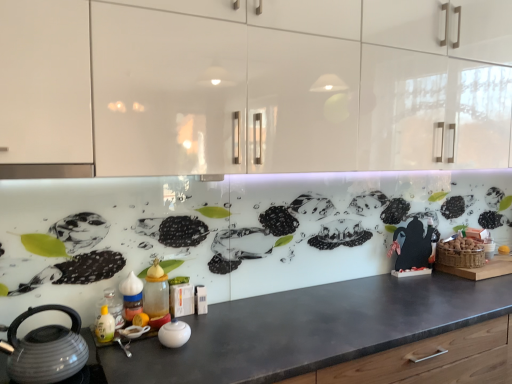
Locate an element on the screen. This screenshot has height=384, width=512. translucent plastic spice jar at center, the 2th bottle when ordered from right to left is located at coordinates (131, 296).

What do you see at coordinates (156, 296) in the screenshot? Image resolution: width=512 pixels, height=384 pixels. I see `translucent glass bottle at center, which appears as the third bottle when viewed from the left` at bounding box center [156, 296].

What do you see at coordinates (253, 86) in the screenshot? I see `white glossy cabinets at upper center` at bounding box center [253, 86].

The width and height of the screenshot is (512, 384). Describe the element at coordinates (111, 307) in the screenshot. I see `translucent plastic bottle at lower left, which is counted as the first bottle, starting from the left` at that location.

The height and width of the screenshot is (384, 512). Find the location of `matte gray kettle at lower left`. matte gray kettle at lower left is located at coordinates (46, 349).

Does white glossy bowl at center have a larger size compared to translucent plastic spice jar at center, the 2th bottle when ordered from right to left?

Incorrect, white glossy bowl at center is not larger than translucent plastic spice jar at center, the 2th bottle when ordered from right to left.

Could you tell me if white glossy bowl at center is facing translucent plastic spice jar at center, the 2th bottle when ordered from right to left?

No, white glossy bowl at center does not turn towards translucent plastic spice jar at center, the 2th bottle when ordered from right to left.

Based on their positions, is white glossy bowl at center located to the left or right of translucent plastic spice jar at center, the 2th bottle when ordered from right to left?

In the image, white glossy bowl at center appears on the right side of translucent plastic spice jar at center, the 2th bottle when ordered from right to left.

Is white glossy bowl at center further to camera compared to translucent plastic spice jar at center, the 2th bottle when ordered from right to left?

No.

Which of these two, white glossy cabinets at upper center or white glossy bowl at center, stands taller?

white glossy cabinets at upper center is taller.

From the image's perspective, is white glossy cabinets at upper center located above white glossy bowl at center?

Correct, white glossy cabinets at upper center appears higher than white glossy bowl at center in the image.

Where is `cabinetry that is above the white glossy bowl at center (from a real-world perspective)`? The image size is (512, 384). cabinetry that is above the white glossy bowl at center (from a real-world perspective) is located at coordinates (253, 86).

Is white glossy cabinets at upper center wider than white glossy bowl at center?

Correct, the width of white glossy cabinets at upper center exceeds that of white glossy bowl at center.

Based on their positions, is matte black countertop at center located to the left or right of matte gray kettle at lower left?

Clearly, matte black countertop at center is on the right of matte gray kettle at lower left in the image.

Identify the location of kettle to the left of matte black countertop at center. (46, 349).

From the image's perspective, is matte black countertop at center positioned above or below matte gray kettle at lower left?

From the image's perspective, matte black countertop at center appears below matte gray kettle at lower left.

How different are the orientations of matte black countertop at center and matte gray kettle at lower left in degrees?

There is a 1.27-degree angle between the facing directions of matte black countertop at center and matte gray kettle at lower left.

From the image's perspective, is translucent plastic spice jar at center, the 2th bottle when ordered from right to left, located beneath white glossy cabinets at upper center?

Yes, from the image's perspective, translucent plastic spice jar at center, the 2th bottle when ordered from right to left, is beneath white glossy cabinets at upper center.

Who is smaller, translucent plastic spice jar at center, the 2th bottle when ordered from right to left, or white glossy cabinets at upper center?

translucent plastic spice jar at center, the 2th bottle when ordered from right to left.

In the image, is translucent plastic spice jar at center, the 2th bottle positioned from the left, on the left side or the right side of white glossy cabinets at upper center?

Clearly, translucent plastic spice jar at center, the 2th bottle positioned from the left, is on the left of white glossy cabinets at upper center in the image.

In the scene shown: Which of these two, translucent glass bottle at center, which is counted as the first bottle, starting from the right, or matte black countertop at center, is wider?

matte black countertop at center.

From a real-world perspective, which is physically above, translucent glass bottle at center, which is counted as the first bottle, starting from the right, or matte black countertop at center?

translucent glass bottle at center, which is counted as the first bottle, starting from the right, from a real-world perspective.

Is point (152, 297) positioned after point (489, 300)?

No, (152, 297) is in front of (489, 300).

Is translucent glass bottle at center, which appears as the third bottle when viewed from the left, bigger or smaller than matte black countertop at center?

In the image, translucent glass bottle at center, which appears as the third bottle when viewed from the left, appears to be smaller than matte black countertop at center.

Does white glossy bowl at center appear on the left side of white glossy cabinets at upper center?

Yes, white glossy bowl at center is to the left of white glossy cabinets at upper center.

Between point (175, 335) and point (403, 36), which one is positioned behind?

The point (403, 36) is farther.

Does white glossy bowl at center have a lesser width compared to white glossy cabinets at upper center?

Yes, white glossy bowl at center is thinner than white glossy cabinets at upper center.

Does matte gray kettle at lower left touch translucent plastic bottle at lower left, which is counted as the first bottle, starting from the left?

No, matte gray kettle at lower left is not next to translucent plastic bottle at lower left, which is counted as the first bottle, starting from the left.

Is point (33, 365) positioned after point (122, 315)?

No.

Who is more distant, matte gray kettle at lower left or translucent plastic bottle at lower left, the third bottle in the right-to-left sequence?

translucent plastic bottle at lower left, the third bottle in the right-to-left sequence, is more distant.

Looking at this image, is matte gray kettle at lower left completely or partially outside of translucent plastic bottle at lower left, which is counted as the first bottle, starting from the left?

Yes, matte gray kettle at lower left is not within translucent plastic bottle at lower left, which is counted as the first bottle, starting from the left.

The width and height of the screenshot is (512, 384). What are the coordinates of `the 2nd bottle behind the white glossy bowl at center` in the screenshot? It's located at (131, 296).

Locate an element on the screen. This screenshot has height=384, width=512. cabinetry lying in front of the white glossy bowl at center is located at coordinates (253, 86).

When comparing their distances from matte gray kettle at lower left, does matte black countertop at center or white glossy bowl at center seem closer?

white glossy bowl at center is closer to matte gray kettle at lower left.

Estimate the real-world distances between objects in this image. Which object is further from translucent plastic spice jar at center, the 2th bottle when ordered from right to left, matte black countertop at center or translucent plastic bottle at lower left, the third bottle in the right-to-left sequence?

matte black countertop at center is further to translucent plastic spice jar at center, the 2th bottle when ordered from right to left.

Estimate the real-world distances between objects in this image. Which object is further from matte black countertop at center, matte gray kettle at lower left or white glossy cabinets at upper center?

Among the two, white glossy cabinets at upper center is located further to matte black countertop at center.

Which object lies nearer to the anchor point matte gray kettle at lower left, matte black countertop at center or translucent glass bottle at center, which is counted as the first bottle, starting from the right?

translucent glass bottle at center, which is counted as the first bottle, starting from the right, lies closer to matte gray kettle at lower left than the other object.

Considering their positions, is translucent plastic bottle at lower left, the third bottle in the right-to-left sequence, positioned closer to white glossy bowl at center than matte black countertop at center?

translucent plastic bottle at lower left, the third bottle in the right-to-left sequence, is positioned closer to the anchor white glossy bowl at center.

Considering their positions, is matte gray kettle at lower left positioned closer to white glossy bowl at center than matte black countertop at center?

Among the two, matte gray kettle at lower left is located nearer to white glossy bowl at center.

Estimate the real-world distances between objects in this image. Which object is further from translucent glass bottle at center, which is counted as the first bottle, starting from the right, translucent plastic spice jar at center, the 2th bottle positioned from the left, or translucent plastic bottle at lower left, which is counted as the first bottle, starting from the left?

translucent plastic bottle at lower left, which is counted as the first bottle, starting from the left.

From the picture: From the image, which object appears to be nearer to white glossy cabinets at upper center, translucent plastic bottle at lower left, which is counted as the first bottle, starting from the left, or translucent glass bottle at center, which is counted as the first bottle, starting from the right?

translucent glass bottle at center, which is counted as the first bottle, starting from the right, is positioned closer to the anchor white glossy cabinets at upper center.

Where is `appliance between white glossy cabinets at upper center and matte black countertop at center vertically`? The image size is (512, 384). appliance between white glossy cabinets at upper center and matte black countertop at center vertically is located at coordinates (174, 334).

Find the location of `appliance between matte gray kettle at lower left and matte black countertop at center in the horizontal direction`. appliance between matte gray kettle at lower left and matte black countertop at center in the horizontal direction is located at coordinates (174, 334).

Where is `kettle between white glossy cabinets at upper center and white glossy bowl at center vertically`? kettle between white glossy cabinets at upper center and white glossy bowl at center vertically is located at coordinates (46, 349).

The image size is (512, 384). What are the coordinates of `appliance located between matte gray kettle at lower left and translucent plastic bottle at lower left, which is counted as the first bottle, starting from the left, in the depth direction` in the screenshot? It's located at (174, 334).